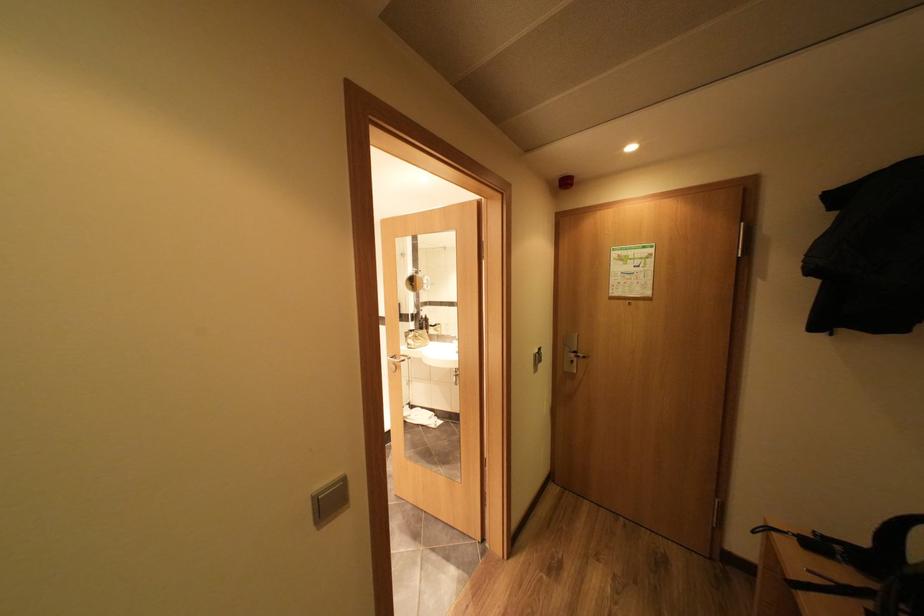
Where would you turn the sink faucet handle? Please return your answer as a coordinate pair (x, y).

(421, 322)